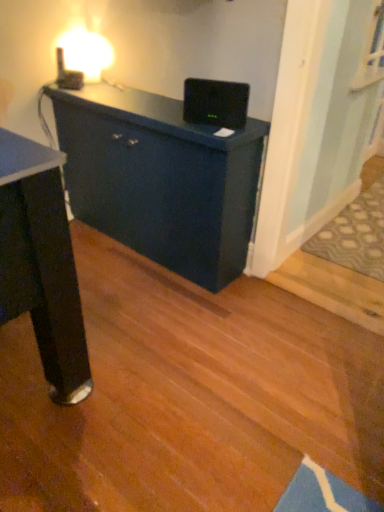
Describe the element at coordinates (216, 103) in the screenshot. I see `black glossy computer monitor at center` at that location.

In order to face black glossy computer monitor at center, should I rotate leftwards or rightwards?

Rotate right and turn 3.159 degrees.

The width and height of the screenshot is (384, 512). Find the location of `black glossy computer monitor at center`. black glossy computer monitor at center is located at coordinates (216, 103).

What is the approximate width of black glossy computer monitor at center?

It is 2.27 inches.

I want to click on black glossy computer monitor at center, so click(216, 103).